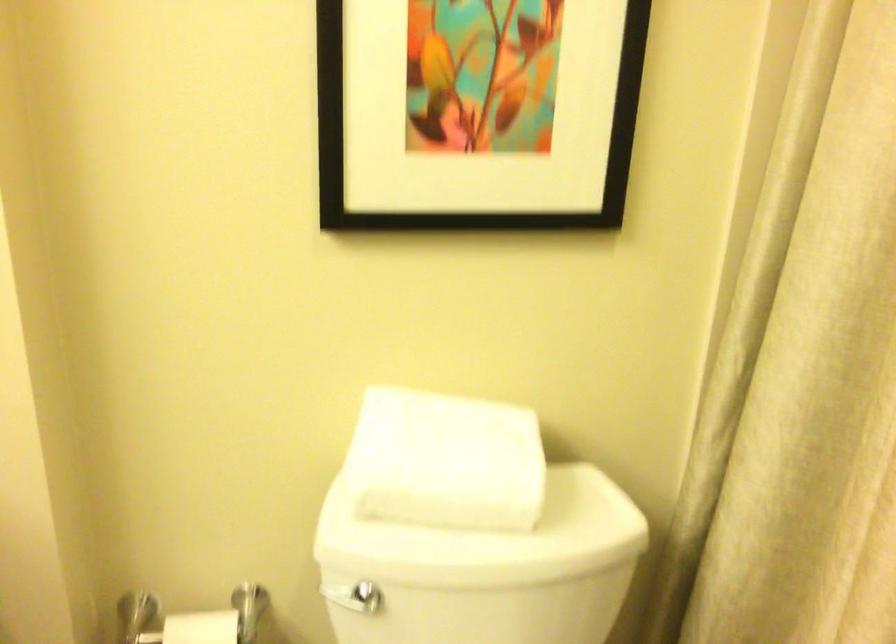
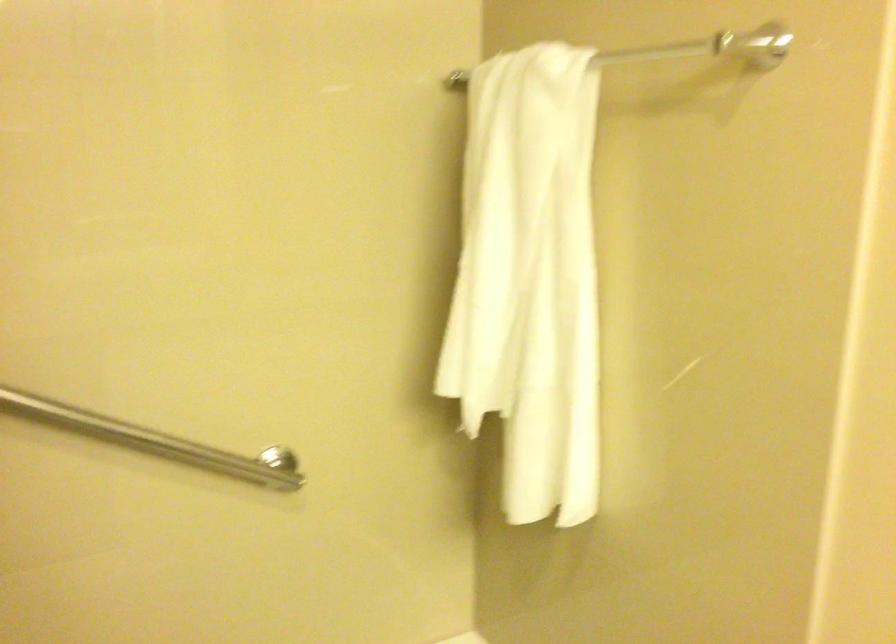
The images are taken continuously from a first-person perspective. In which direction is your viewpoint rotating?

The rotation direction of the camera is right-down.